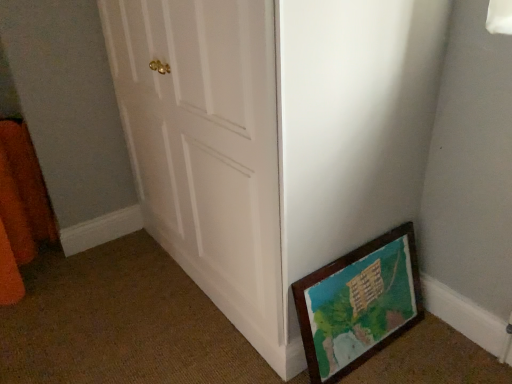
Question: Does wooden picture frame at lower right have a larger size compared to orange fuzzy curtain at left?

Choices:
 (A) no
 (B) yes

Answer: (A)

Question: From a real-world perspective, is wooden picture frame at lower right under orange fuzzy curtain at left?

Choices:
 (A) no
 (B) yes

Answer: (B)

Question: From the image's perspective, is wooden picture frame at lower right beneath orange fuzzy curtain at left?

Choices:
 (A) no
 (B) yes

Answer: (B)

Question: Does wooden picture frame at lower right have a greater width compared to orange fuzzy curtain at left?

Choices:
 (A) no
 (B) yes

Answer: (A)

Question: Is wooden picture frame at lower right placed right next to orange fuzzy curtain at left?

Choices:
 (A) yes
 (B) no

Answer: (B)

Question: Considering the relative positions of orange fuzzy curtain at left and white wooden door at center in the image provided, is orange fuzzy curtain at left to the left or to the right of white wooden door at center?

Choices:
 (A) right
 (B) left

Answer: (B)

Question: Is orange fuzzy curtain at left in front of or behind white wooden door at center in the image?

Choices:
 (A) front
 (B) behind

Answer: (B)

Question: From the image's perspective, relative to white wooden door at center, is orange fuzzy curtain at left above or below?

Choices:
 (A) below
 (B) above

Answer: (A)

Question: In terms of width, does orange fuzzy curtain at left look wider or thinner when compared to white wooden door at center?

Choices:
 (A) wide
 (B) thin

Answer: (B)

Question: From a real-world perspective, is white wooden door at center physically located above or below wooden picture frame at lower right?

Choices:
 (A) above
 (B) below

Answer: (A)

Question: In the image, is white wooden door at center on the left side or the right side of wooden picture frame at lower right?

Choices:
 (A) left
 (B) right

Answer: (A)

Question: Considering their positions, is white wooden door at center located in front of or behind wooden picture frame at lower right?

Choices:
 (A) front
 (B) behind

Answer: (A)

Question: Does point (180, 211) appear closer or farther from the camera than point (338, 375)?

Choices:
 (A) closer
 (B) farther

Answer: (B)

Question: From a real-world perspective, is orange fuzzy curtain at left positioned above or below wooden picture frame at lower right?

Choices:
 (A) below
 (B) above

Answer: (B)

Question: Is orange fuzzy curtain at left to the left or to the right of wooden picture frame at lower right in the image?

Choices:
 (A) right
 (B) left

Answer: (B)